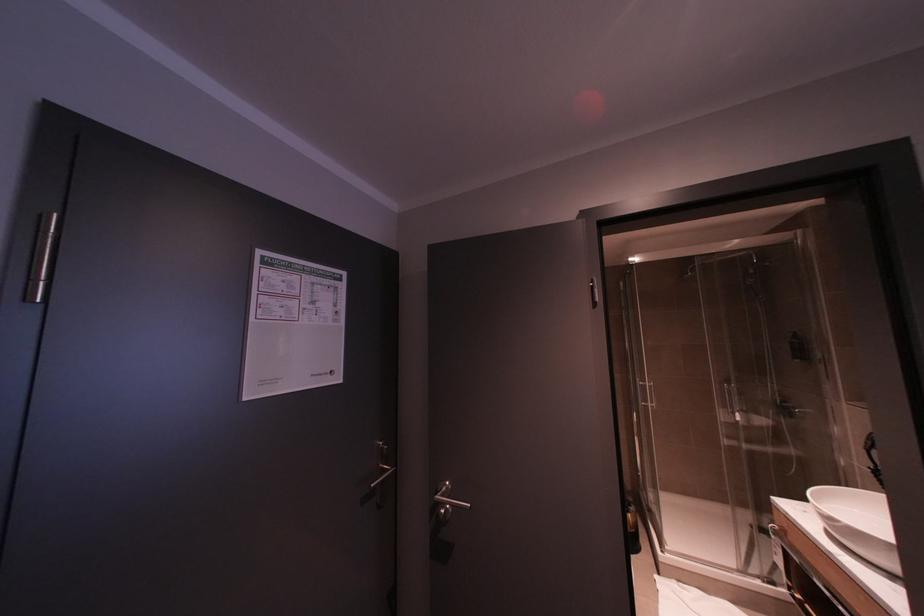
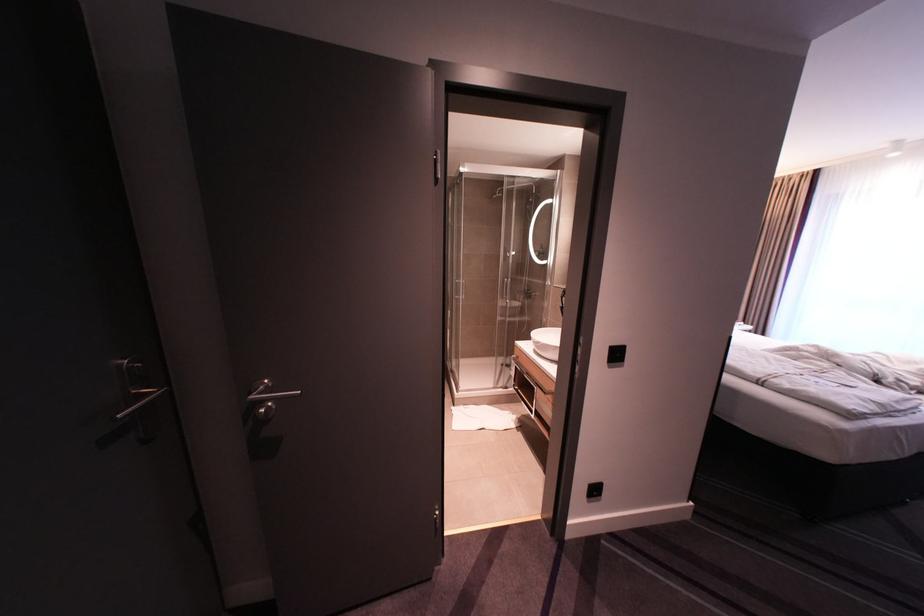
The images are taken continuously from a first-person perspective. In which direction is your viewpoint rotating?

The camera rotated toward right-down.